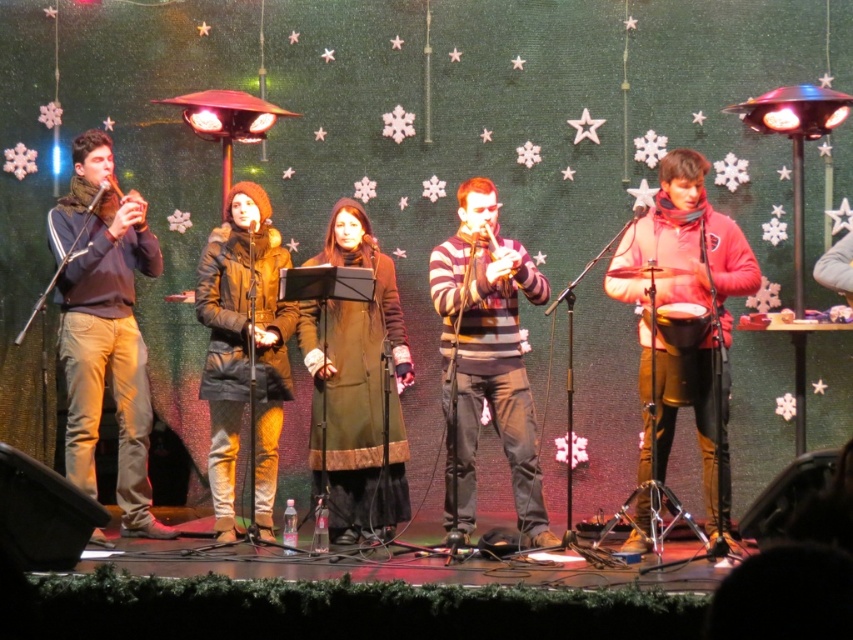
Question: Which point appears closest to the camera in this image?

Choices:
 (A) (117, 186)
 (B) (335, 515)
 (C) (454, 298)
 (D) (267, 458)

Answer: (C)

Question: Does matte blue sweater at left have a larger size compared to dark brown leather coat at center?

Choices:
 (A) no
 (B) yes

Answer: (B)

Question: Does striped sweater at center have a lesser width compared to matte wood flute at left?

Choices:
 (A) no
 (B) yes

Answer: (A)

Question: From the image, what is the correct spatial relationship of dark brown leather coat at center in relation to matte wood flute at left?

Choices:
 (A) below
 (B) above

Answer: (A)

Question: Which of these objects is positioned farthest from the pink matte drum at right?

Choices:
 (A) dark brown leather coat at center
 (B) striped sweater at center
 (C) matte wood flute at left

Answer: (C)

Question: Which object is positioned closest to the striped sweater at center?

Choices:
 (A) matte wood flute at left
 (B) dark brown leather coat at center

Answer: (B)